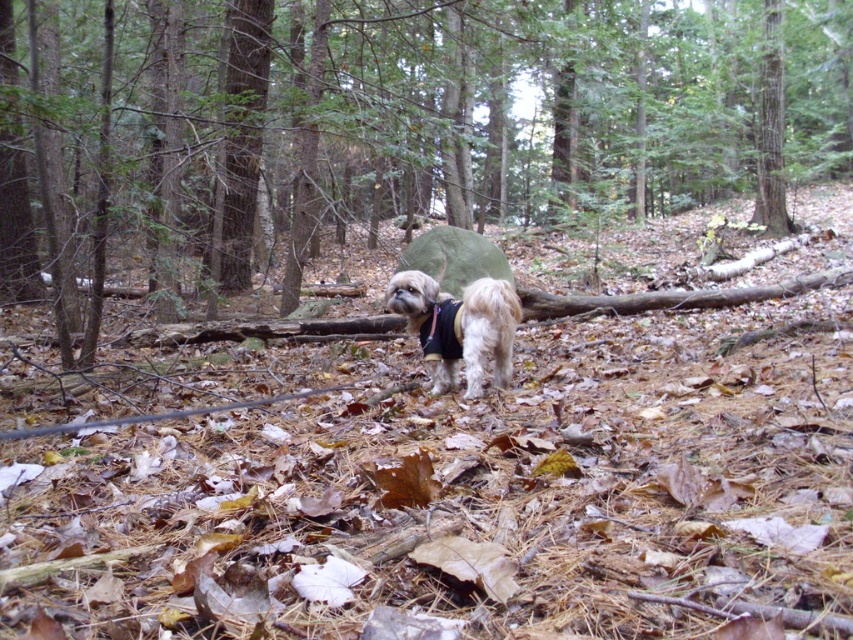
Question: Does green matte tent at center appear on the left side of fuzzy white dog at center?

Choices:
 (A) yes
 (B) no

Answer: (B)

Question: Can you confirm if green matte tent at center is bigger than fuzzy white dog at center?

Choices:
 (A) yes
 (B) no

Answer: (A)

Question: Which object appears farthest from the camera in this image?

Choices:
 (A) fuzzy white dog at center
 (B) green matte tent at center

Answer: (A)

Question: Which object is farther from the camera taking this photo?

Choices:
 (A) green matte tent at center
 (B) fuzzy white dog at center

Answer: (B)

Question: Can you confirm if green matte tent at center is positioned above fuzzy white dog at center?

Choices:
 (A) yes
 (B) no

Answer: (A)

Question: Which of the following is the farthest from the observer?

Choices:
 (A) fuzzy white dog at center
 (B) green matte tent at center

Answer: (A)